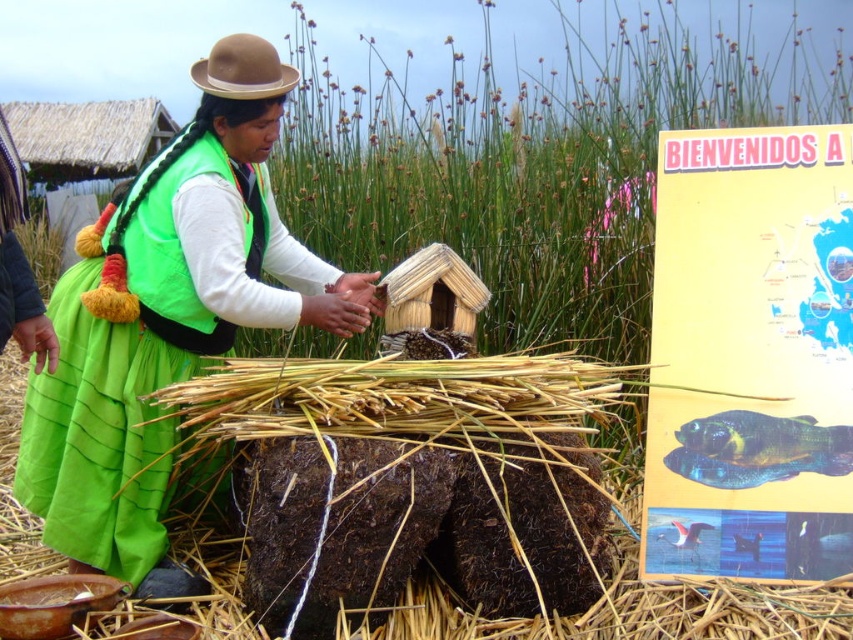
You are a tourist visiting a craft fair and see the yellow paper sign at right and the green fabric skirt at center. Which object is shorter in height?

The yellow paper sign at right is not as tall as the green fabric skirt at center, so the yellow paper sign at right is shorter in height.

You are standing in front of a craft activity scene. There is a point at coordinate (751, 355). What object is this point located on?

The point at coordinate (751, 355) is located on the yellow paper sign at right.